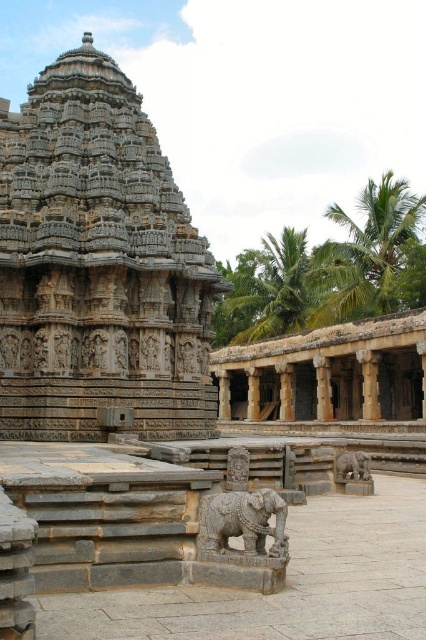
How far apart are gray stone hindu temple at center and brown stone pillar at center?

33.61 meters

This screenshot has height=640, width=426. Identify the location of gray stone hindu temple at center. (97, 266).

This screenshot has height=640, width=426. I want to click on gray stone hindu temple at center, so click(x=97, y=266).

Can you confirm if carved stone elephant at center is thinner than brown stone pillar at center?

Incorrect, carved stone elephant at center's width is not less than brown stone pillar at center's.

Which of these two, carved stone elephant at center or brown stone pillar at center, stands taller?

brown stone pillar at center

Is point (250, 500) closer to viewer compared to point (322, 410)?

Yes.

You are a GUI agent. You are given a task and a screenshot of the screen. Output one action in this format:
    pyautogui.click(x=<x>, y=<y>)
    Task: Click on the carved stone elephant at center
    Image resolution: width=426 pixels, height=640 pixels.
    Given the screenshot: What is the action you would take?
    pyautogui.click(x=241, y=524)

Between gray stone elephant at lower center and brown stone pillar at center, which one is positioned higher?

brown stone pillar at center

Can you confirm if gray stone elephant at lower center is positioned to the left of brown stone pillar at center?

Indeed, gray stone elephant at lower center is positioned on the left side of brown stone pillar at center.

Is point (363, 477) more distant than point (322, 397)?

That is False.

The height and width of the screenshot is (640, 426). In order to click on gray stone elephant at lower center in this screenshot , I will do `click(351, 467)`.